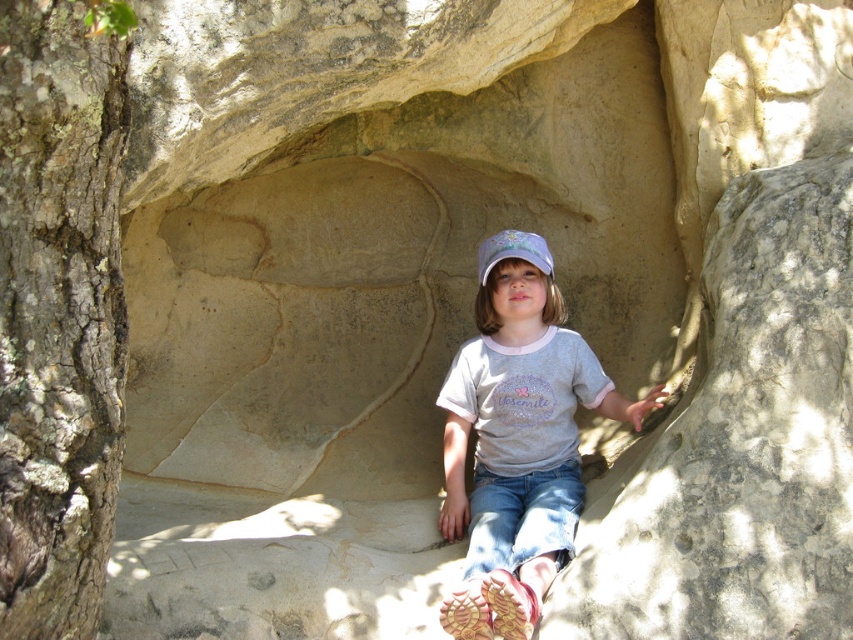
You are a photographer trying to capture the child in the rock formation. You notice the matte gray shirt at center and the white cotton cap at center. Which object is positioned closer to the camera?

The matte gray shirt at center is closer to the viewer than the white cotton cap at center, so the shirt is closer to the camera.

You are a photographer setting up a shot of the child in the cave. You need to ensure the brown rough bark tree at left and the white cotton cap at center are both visible. Which object should you focus on first to frame the shot properly?

The brown rough bark tree at left is taller than the white cotton cap at center, so you should focus on the brown rough bark tree at left first to ensure it fits within the frame before adjusting for the smaller cap.